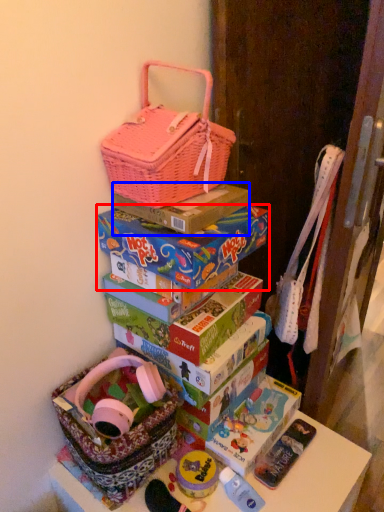
Question: Which object appears farthest to the camera in this image, box (highlighted by a red box) or box (highlighted by a blue box)?

Choices:
 (A) box
 (B) box

Answer: (B)